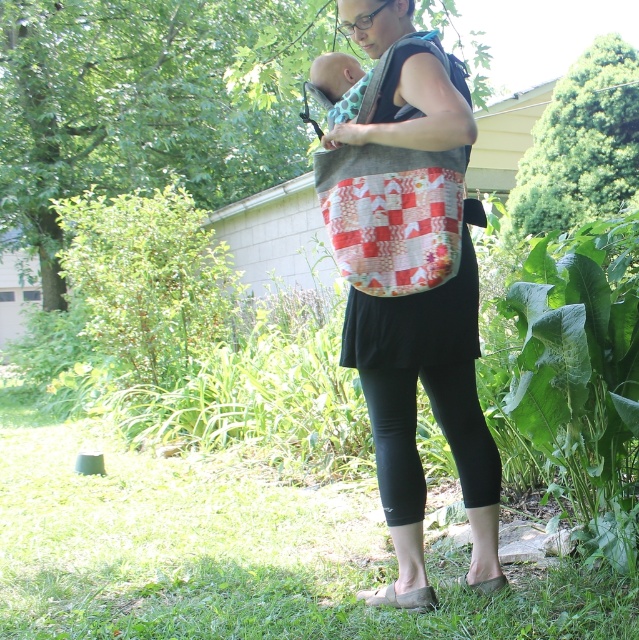
Question: Which point is closer to the camera taking this photo?

Choices:
 (A) (450, 296)
 (B) (472, 410)
 (C) (397, 280)

Answer: (C)

Question: Estimate the real-world distances between objects in this image. Which object is farther from the quilted fabric bag at center?

Choices:
 (A) patchwork fabric bag at center
 (B) black stretchy leggings at lower center

Answer: (A)

Question: Among these points, which one is farthest from the camera?

Choices:
 (A) (385, 372)
 (B) (412, 106)
 (C) (420, 208)

Answer: (A)

Question: Observing the image, what is the correct spatial positioning of quilted fabric bag at center in reference to patchwork fabric bag at center?

Choices:
 (A) left
 (B) right

Answer: (B)

Question: Does quilted fabric bag at center have a smaller size compared to patchwork fabric bag at center?

Choices:
 (A) no
 (B) yes

Answer: (B)

Question: Considering the relative positions of patchwork fabric bag at center and black stretchy leggings at lower center in the image provided, where is patchwork fabric bag at center located with respect to black stretchy leggings at lower center?

Choices:
 (A) above
 (B) below

Answer: (A)